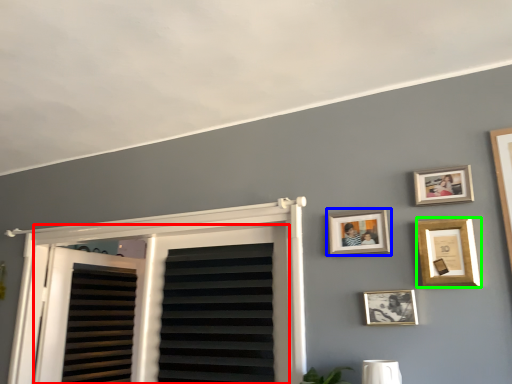
Question: Considering the real-world distances, which object is farthest from window (highlighted by a red box)? picture frame (highlighted by a blue box) or picture frame (highlighted by a green box)?

Choices:
 (A) picture frame
 (B) picture frame

Answer: (B)